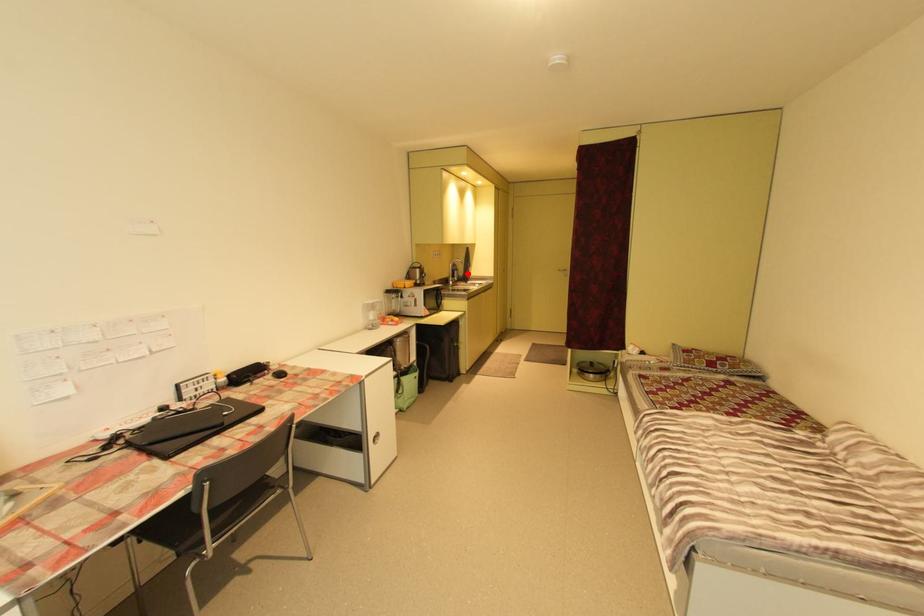
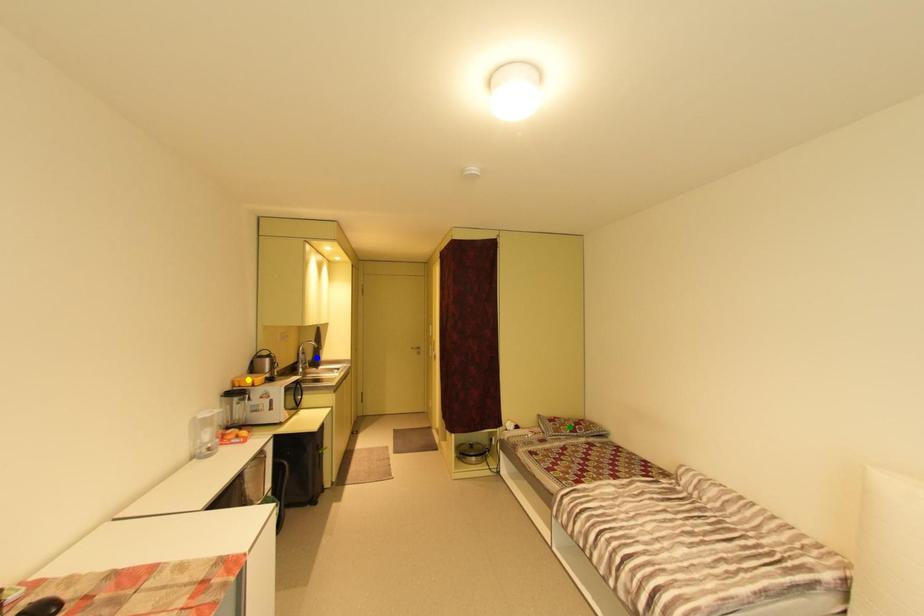
Question: I am providing you with two images of the same scene from different viewpoints. A red point is marked on the first image. You are given multiple points on the second image. Which point in image 2 is actually the same real-world point as the red point in image 1?

Choices:
 (A) green point
 (B) blue point
 (C) yellow point

Answer: (B)